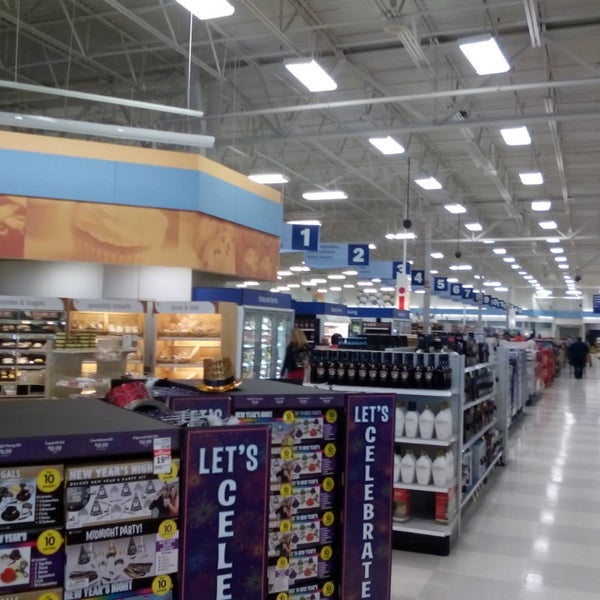
The width and height of the screenshot is (600, 600). I want to click on shelf of white bottles, so click(426, 458), click(428, 418).